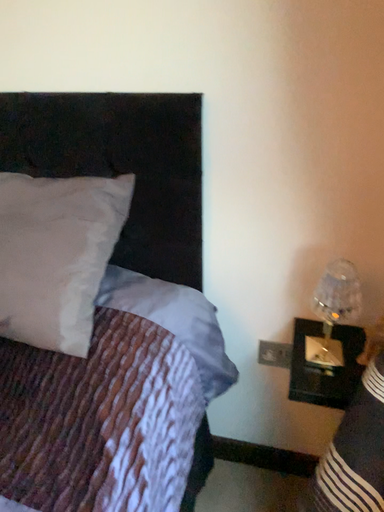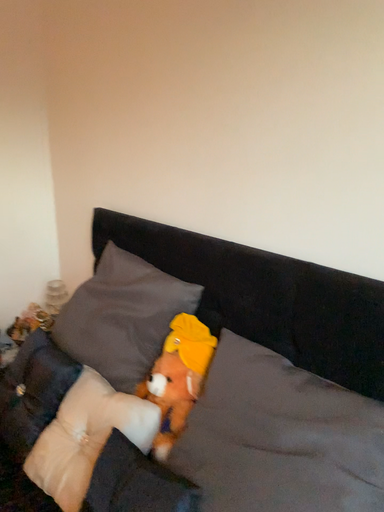
Question: Which way did the camera rotate in the video?

Choices:
 (A) rotated upward
 (B) rotated downward

Answer: (A)